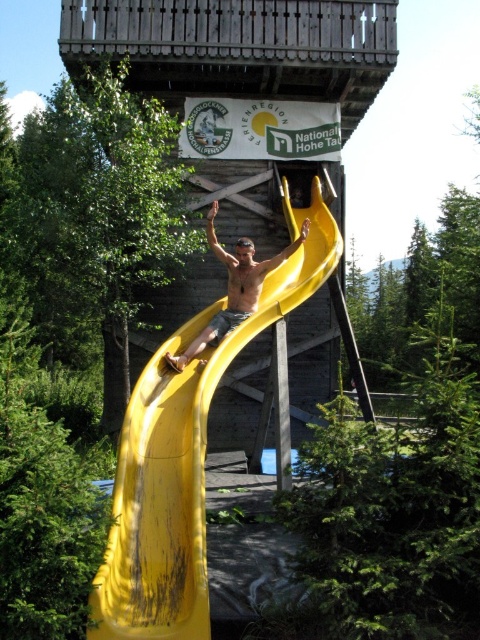
Is yellow rubber slide at center positioned behind matte yellow slide at center?

No, yellow rubber slide at center is in front of matte yellow slide at center.

Can you confirm if yellow rubber slide at center is positioned to the right of matte yellow slide at center?

Indeed, yellow rubber slide at center is positioned on the right side of matte yellow slide at center.

Between point (110, 545) and point (228, 260), which one is positioned in front?

Point (110, 545) is more forward.

Locate an element on the screen. yellow rubber slide at center is located at coordinates (186, 458).

Does point (123, 636) come closer to viewer compared to point (355, 3)?

Yes, it is.

Which of these two, yellow rubber slide at center or wooden at center, stands shorter?

With less height is wooden at center.

This screenshot has height=640, width=480. What do you see at coordinates (186, 458) in the screenshot?
I see `yellow rubber slide at center` at bounding box center [186, 458].

You are a GUI agent. You are given a task and a screenshot of the screen. Output one action in this format:
    pyautogui.click(x=<x>, y=<y>)
    Task: Click on the yellow rubber slide at center
    This screenshot has width=480, height=640.
    Given the screenshot: What is the action you would take?
    pyautogui.click(x=186, y=458)

Between wooden at center and matte yellow slide at center, which one is positioned higher?

wooden at center

From the picture: Does wooden at center have a smaller size compared to matte yellow slide at center?

Indeed, wooden at center has a smaller size compared to matte yellow slide at center.

What do you see at coordinates (240, 45) in the screenshot?
I see `wooden at center` at bounding box center [240, 45].

Locate an element on the screen. wooden at center is located at coordinates (240, 45).